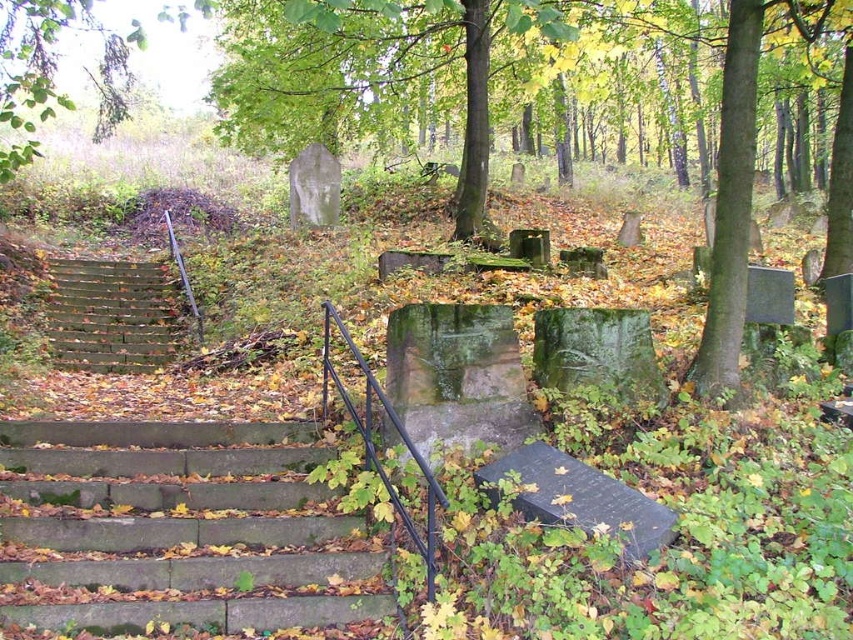
You are a gardener tasked with maintaining the cemetery. You need to place a decorative stone that is exactly 1 meter wide between the green mossy stone at center and the wooden stairs at lower left. Can you fit it there?

The green mossy stone at center is wider than the wooden stairs at lower left. Since the decorative stone needs to be exactly 1 meter wide, you should check the available space between them. However, the description only states the width comparison between the two objects, not the actual distance between them. Without knowing the distance between the green mossy stone at center and the wooden stairs at lower left, it is impossible to determine if the 1 meter wide stone will fit.

You are a maintenance worker tasked with clearing leaves from the stairs in the cemetery. You have a leaf blower that can effectively clear a path 1.2 meters wide. The brown concrete stairs at lower left and the wooden stairs at lower left are both covered in leaves. Which set of stairs can you clear completely with your leaf blower?

The wooden stairs at lower left can be cleared completely because their width is greater than the brown concrete stairs at lower left, which is narrower than the leaf blower path requirement of 1.2 meters.